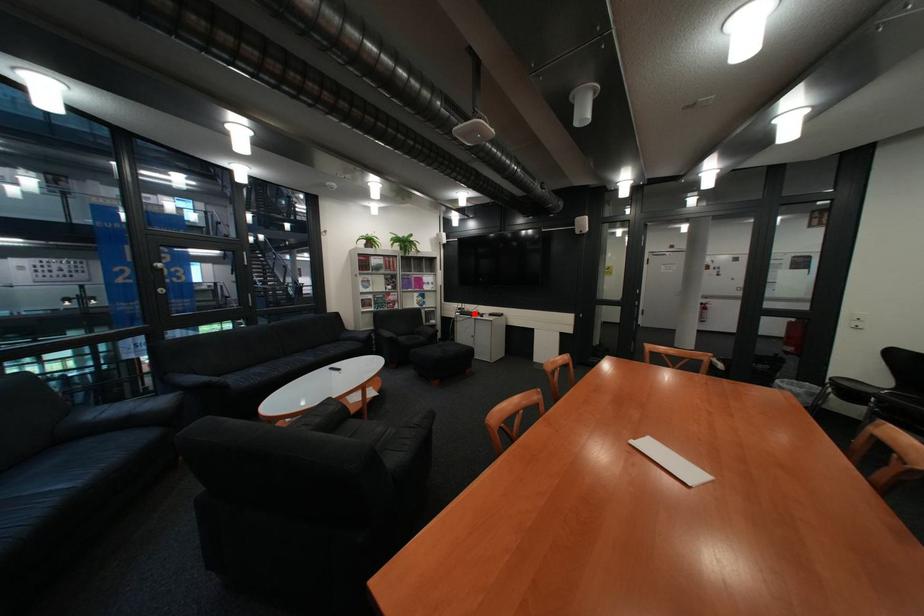
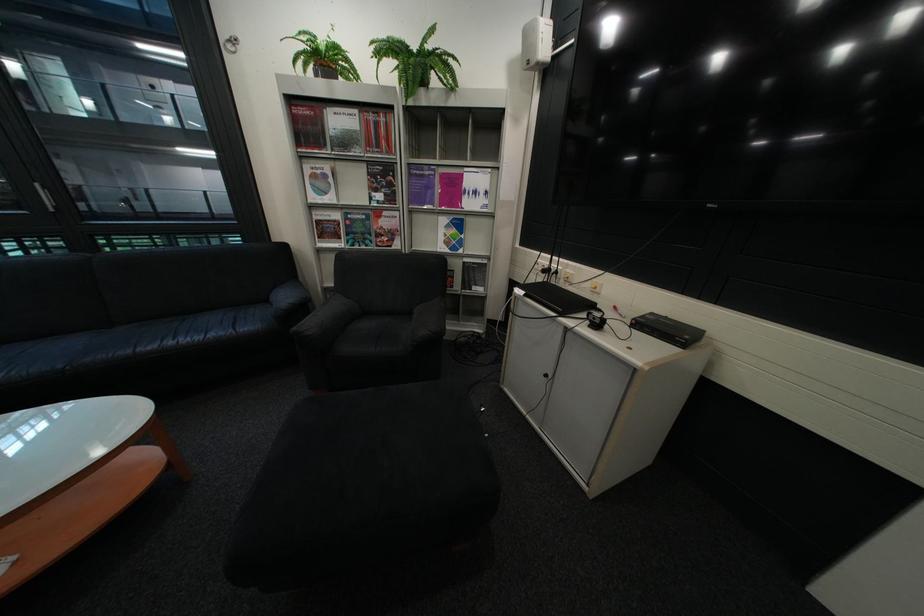
In the second image, find the point that corresponds to the highlighted location in the first image.

(538, 293)